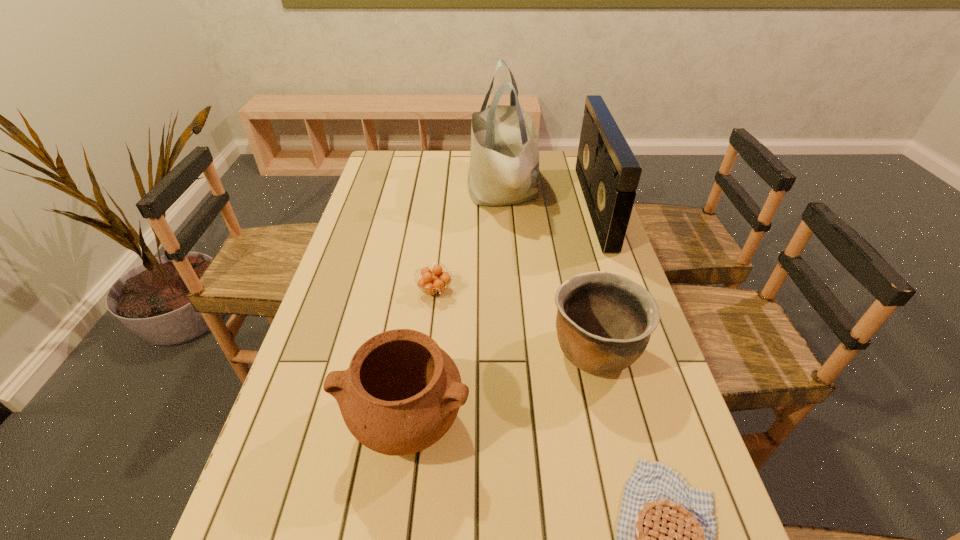
I want to click on free region that satisfies the following two spatial constraints: 1. on the front side of the videotape; 2. on the front side of the shorter pottery, so click(x=645, y=351).

This screenshot has height=540, width=960. Identify the location of free spot that satisfies the following two spatial constraints: 1. on the back side of the left pottery; 2. on the left side of the fourth nearest object. (424, 291).